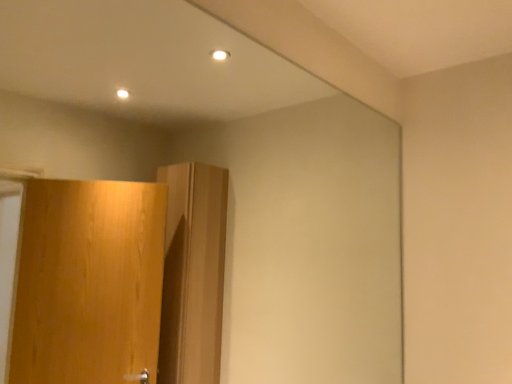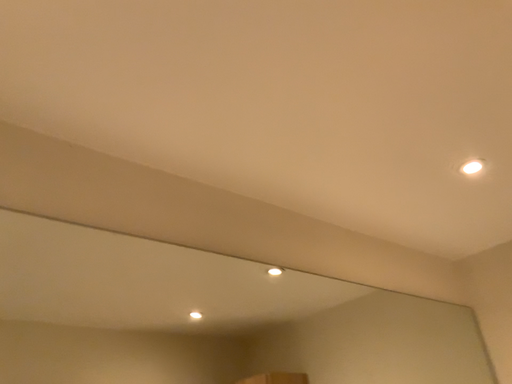
Question: How did the camera likely rotate when shooting the video?

Choices:
 (A) rotated right
 (B) rotated left

Answer: (B)